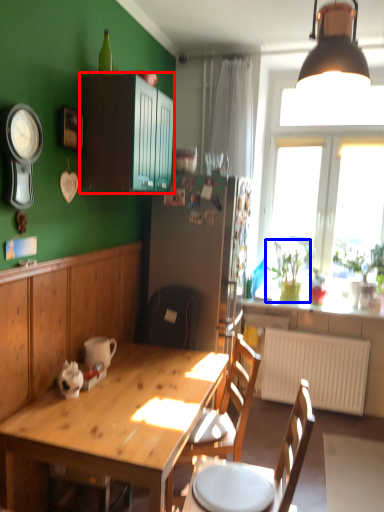
Question: Which object is closer to the camera taking this photo, cabinetry (highlighted by a red box) or houseplant (highlighted by a blue box)?

Choices:
 (A) cabinetry
 (B) houseplant

Answer: (A)